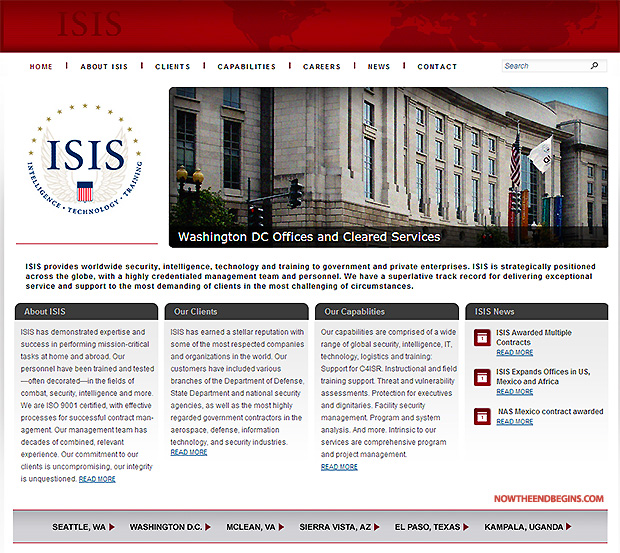
Find the location of `"home"`. "home" is located at coordinates (33, 66).